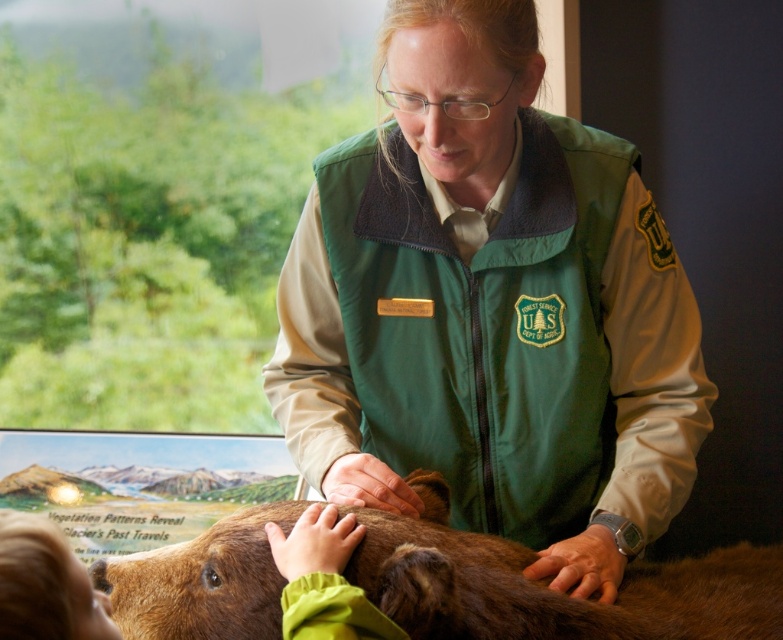
Question: Which point is closer to the camera?

Choices:
 (A) green fleece vest at center
 (B) brown furry bear at center

Answer: (B)

Question: Which point is farther to the camera?

Choices:
 (A) (557, 516)
 (B) (455, 588)

Answer: (A)

Question: Does green fleece vest at center have a smaller size compared to brown furry bear at center?

Choices:
 (A) no
 (B) yes

Answer: (A)

Question: Which point appears farthest from the camera in this image?

Choices:
 (A) (724, 618)
 (B) (323, 177)

Answer: (B)

Question: Can you confirm if green fleece vest at center is positioned to the right of brown furry bear at center?

Choices:
 (A) no
 (B) yes

Answer: (B)

Question: Does green fleece vest at center appear on the right side of brown furry bear at center?

Choices:
 (A) yes
 (B) no

Answer: (A)